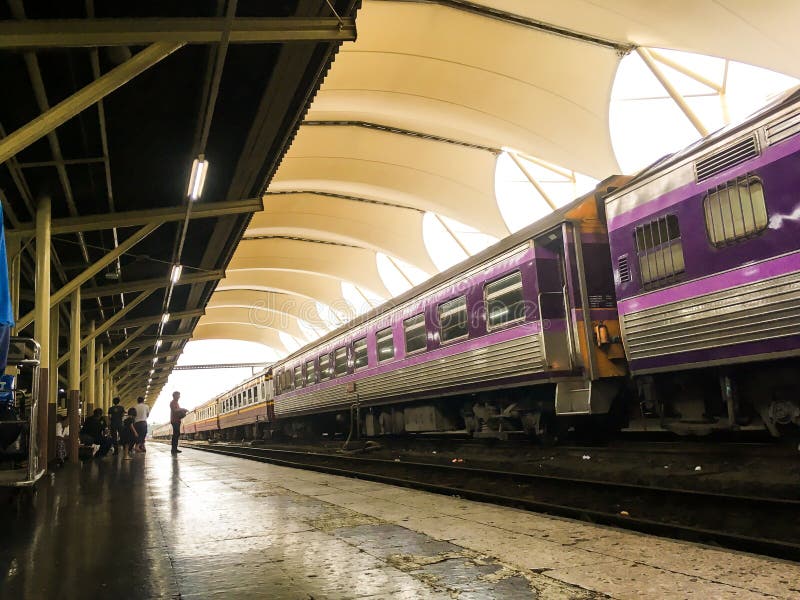
Locate an element on the screen. This screenshot has height=600, width=800. window is located at coordinates (502, 308).